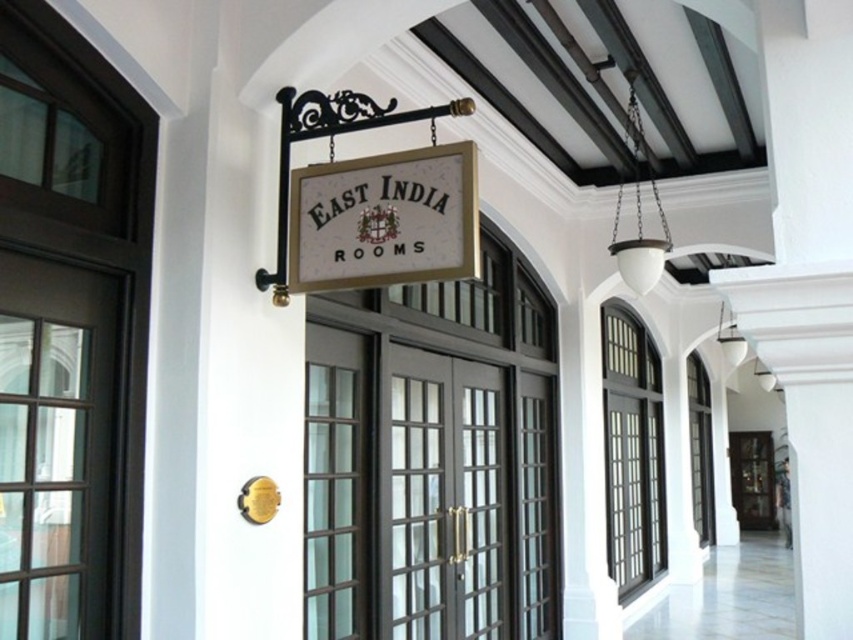
Question: Is matte black door at center below white wood sign at center?

Choices:
 (A) yes
 (B) no

Answer: (A)

Question: Which point is closer to the camera taking this photo?

Choices:
 (A) (450, 410)
 (B) (403, 172)

Answer: (B)

Question: Is matte black door at center positioned at the back of white wood sign at center?

Choices:
 (A) no
 (B) yes

Answer: (B)

Question: Is matte black door at center bigger than white wood sign at center?

Choices:
 (A) no
 (B) yes

Answer: (B)